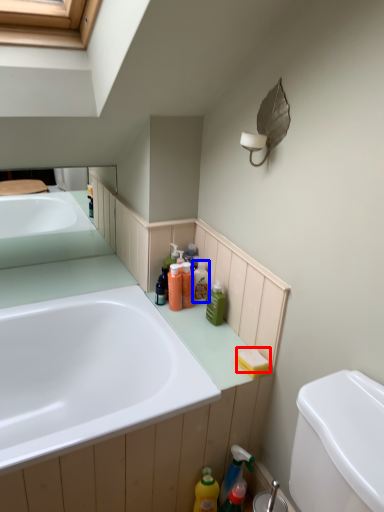
Question: Which point is further to the camera, soap (highlighted by a red box) or toiletry (highlighted by a blue box)?

Choices:
 (A) soap
 (B) toiletry

Answer: (B)